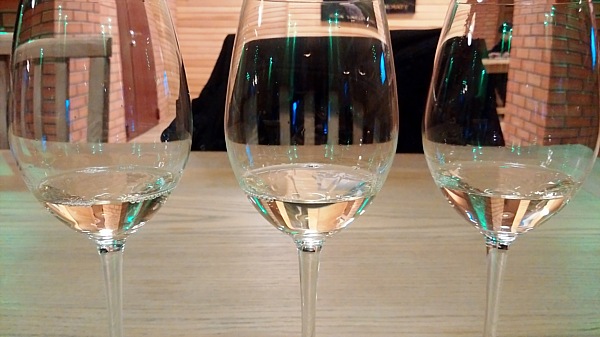
You are a GUI agent. You are given a task and a screenshot of the screen. Output one action in this format:
    pyautogui.click(x=<x>, y=<y>)
    Task: Click on the glass
    
    Given the screenshot: What is the action you would take?
    pyautogui.click(x=119, y=101), pyautogui.click(x=339, y=82), pyautogui.click(x=507, y=82)